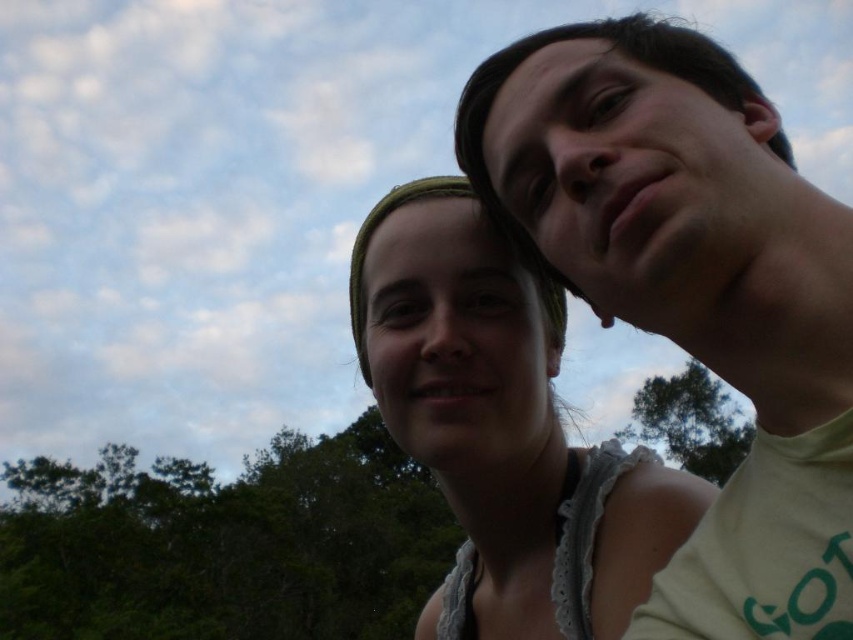
You are standing at the point labeled point [587,141] and want to walk towards the point labeled point [216,540]. Based on the scene description, will you be moving towards the background or the foreground of the image?

Since point [587,141] is in front of point [216,540], moving from point [587,141] towards point [216,540] would mean moving towards the background of the image.

You are a photographer trying to capture a portrait of the two people in the scene. Since the green leafy tree at upper right is casting a shadow over the matte white shirt at center, will the tree block the sunlight from reaching the shirt?

The green leafy tree at upper right is taller than the matte white shirt at center, so it is possible that the tree could cast a shadow over the shirt, blocking some sunlight. Adjust the positioning or lighting to ensure proper illumination for the portrait.